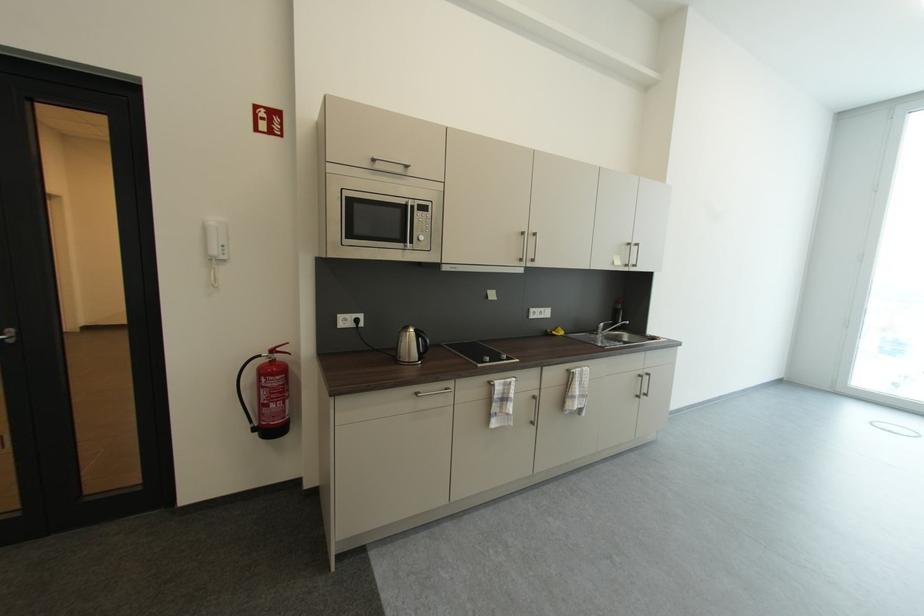
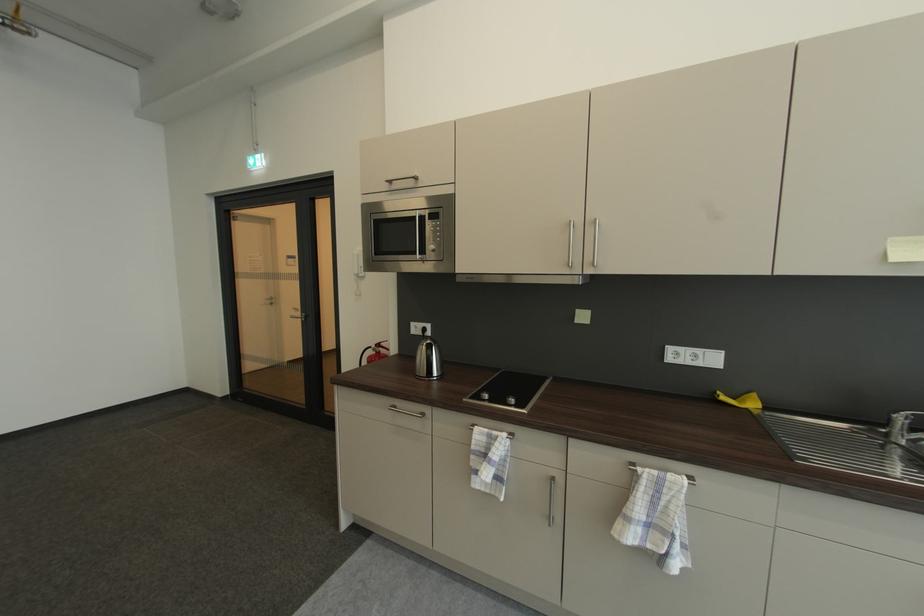
The point at [423,362] is marked in the first image. Where is the corresponding point in the second image?

(432, 378)